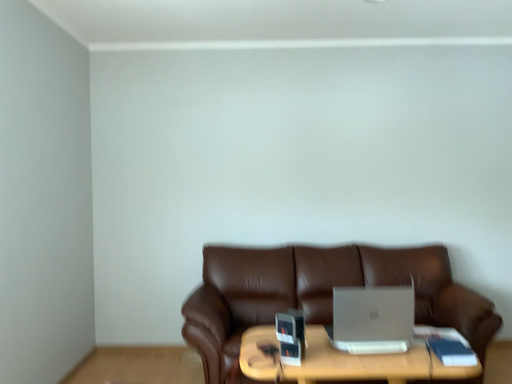
Question: Considering the relative sizes of brown leather couch at center and silver metallic laptop at center in the image provided, is brown leather couch at center wider than silver metallic laptop at center?

Choices:
 (A) no
 (B) yes

Answer: (B)

Question: Is brown leather couch at center outside of silver metallic laptop at center?

Choices:
 (A) yes
 (B) no

Answer: (A)

Question: Considering the relative positions of brown leather couch at center and silver metallic laptop at center in the image provided, is brown leather couch at center to the right of silver metallic laptop at center from the viewer's perspective?

Choices:
 (A) no
 (B) yes

Answer: (B)

Question: Considering the relative positions of brown leather couch at center and silver metallic laptop at center in the image provided, is brown leather couch at center to the left of silver metallic laptop at center from the viewer's perspective?

Choices:
 (A) yes
 (B) no

Answer: (B)

Question: From a real-world perspective, is brown leather couch at center below silver metallic laptop at center?

Choices:
 (A) no
 (B) yes

Answer: (B)

Question: Is brown leather couch at center shorter than silver metallic laptop at center?

Choices:
 (A) yes
 (B) no

Answer: (B)

Question: Does wooden table at center have a lesser height compared to silver metallic laptop at center?

Choices:
 (A) no
 (B) yes

Answer: (A)

Question: Does wooden table at center have a lesser width compared to silver metallic laptop at center?

Choices:
 (A) no
 (B) yes

Answer: (A)

Question: Is wooden table at center wider than silver metallic laptop at center?

Choices:
 (A) no
 (B) yes

Answer: (B)

Question: Considering the relative positions of wooden table at center and silver metallic laptop at center in the image provided, is wooden table at center behind silver metallic laptop at center?

Choices:
 (A) no
 (B) yes

Answer: (A)

Question: Does wooden table at center appear on the right side of silver metallic laptop at center?

Choices:
 (A) yes
 (B) no

Answer: (B)

Question: Is wooden table at center far from silver metallic laptop at center?

Choices:
 (A) no
 (B) yes

Answer: (A)

Question: Is silver metallic laptop at center taller than brown leather couch at center?

Choices:
 (A) yes
 (B) no

Answer: (B)